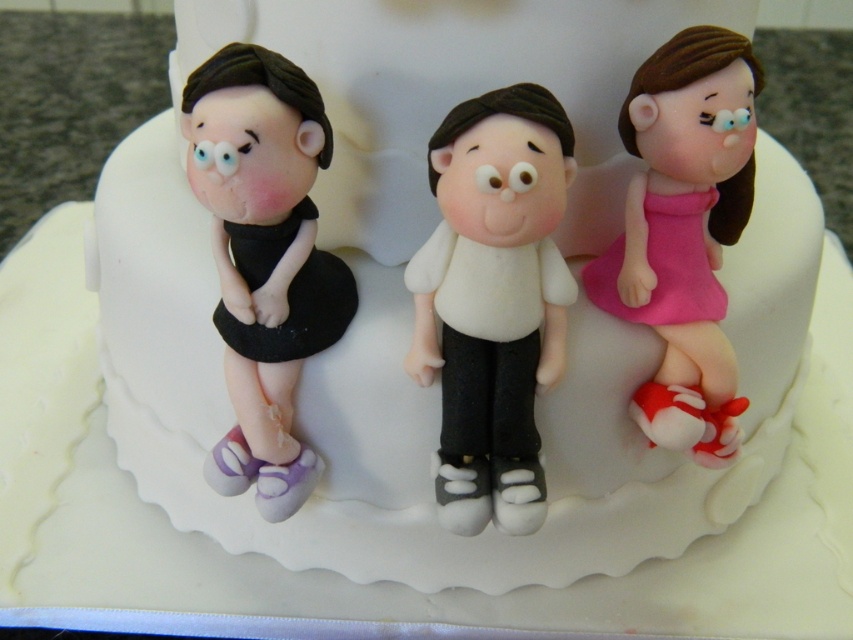
Question: Which point is closer to the camera?

Choices:
 (A) (567, 147)
 (B) (706, 170)
 (C) (265, 250)

Answer: (A)

Question: Is white matte figure at center bigger than matte black dress at left?

Choices:
 (A) yes
 (B) no

Answer: (B)

Question: Can you confirm if white matte figure at center is positioned above pink matte dress at right?

Choices:
 (A) no
 (B) yes

Answer: (A)

Question: Where is white matte figure at center located in relation to pink matte dress at right in the image?

Choices:
 (A) below
 (B) above

Answer: (A)

Question: Which object is positioned closest to the matte black dress at left?

Choices:
 (A) white matte figure at center
 (B) pink matte dress at right

Answer: (A)

Question: Which object appears farthest from the camera in this image?

Choices:
 (A) matte black dress at left
 (B) pink matte dress at right
 (C) white matte figure at center

Answer: (B)